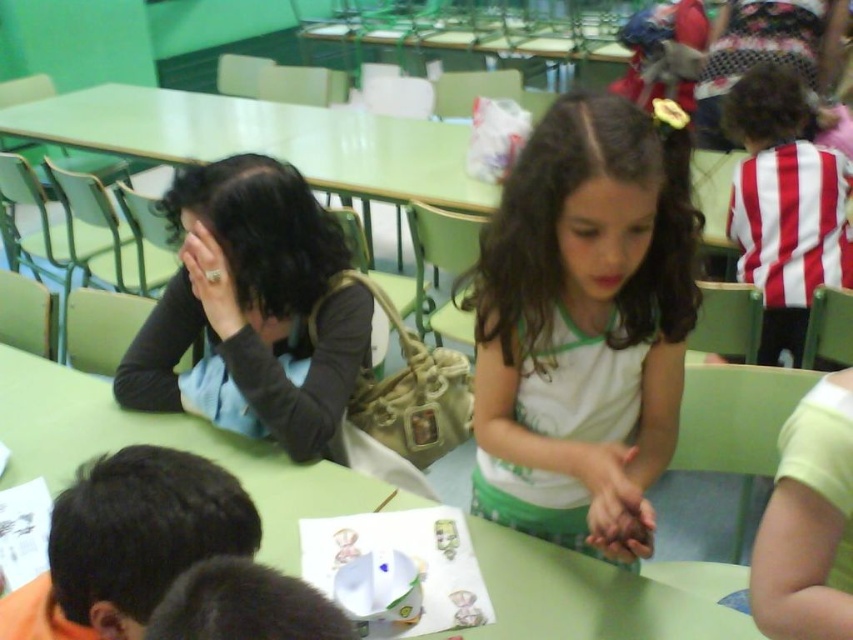
You are a visitor observing the scene from the entrance of the room. You notice the green matte table at center and the dark brown hair at lower left. Based on their positions, which object is closer to the entrance?

The dark brown hair at lower left is closer to the entrance because it is above the green matte table at center, indicating it is nearer to the viewer.

You are a photographer setting up for a group photo. You notice two elements in the scene that might be distracting in the background. The black matte shirt at left and the dark brown hair at lower left. Which of these two elements should you adjust your camera angle to hide first, considering their sizes?

The black matte shirt at left is larger in size than the dark brown hair at lower left, so you should adjust your camera angle to hide the black matte shirt at left first because it is the larger distracting element.

You are standing in the classroom and want to hand out a craft kit to the child wearing the white matte shirt at center and the child wearing the black matte shirt at left. Which child should you approach first to ensure you can easily reach them without needing to move around others?

You should approach the child wearing the white matte shirt at center first because they are closer to you than the black matte shirt at left, making them easier to reach without needing to move around others.